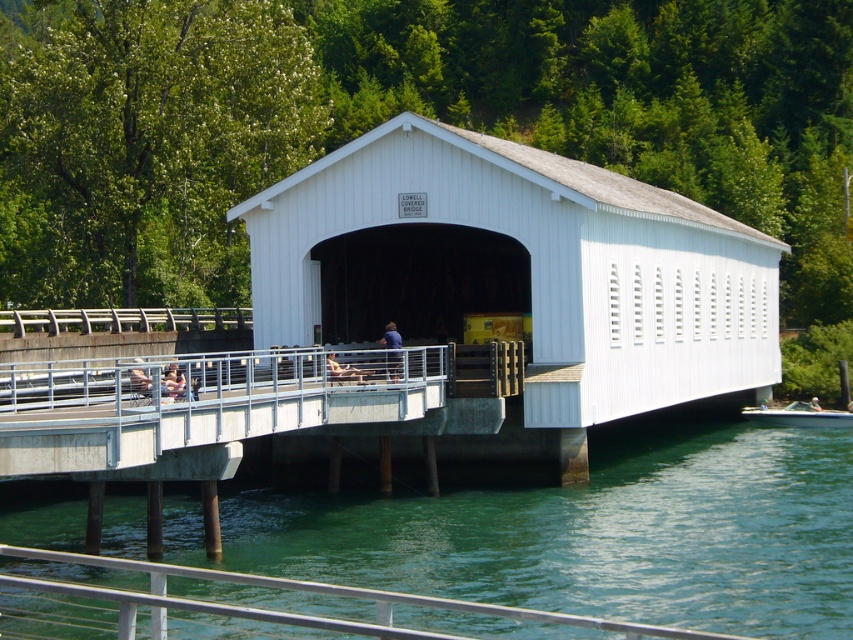
You are planning to kayak from the green fabric kayak at center to the green translucent water at lower center. Can you reach the water from the kayak without moving the kayak?

The green translucent water at lower center and green fabric kayak at center are 20.63 meters apart, so you cannot reach the water from the kayak without moving the kayak since they are too far apart.

You are standing on the Lowell Covered Bridge and want to sit down. There is a light brown wooden chair at center. Is this chair positioned closer to the entrance of the bridge or the middle section?

The light brown wooden chair at center is located at point coordinates that place it in the middle section of the bridge, so it is closer to the middle section rather than the entrance.

Consider the image. You are standing at the entrance of the Lowell Covered Bridge and want to take a photo of the light brown wooden chair at center and the green fabric kayak at center. Since you want both objects to be clearly visible in the frame, which object should you position closer to the camera to ensure both are in focus?

The light brown wooden chair at center is in front of the green fabric kayak at center. To ensure both are in focus, position the light brown wooden chair at center closer to the camera since it is already in front, allowing the kayak to be in the background without blurring.